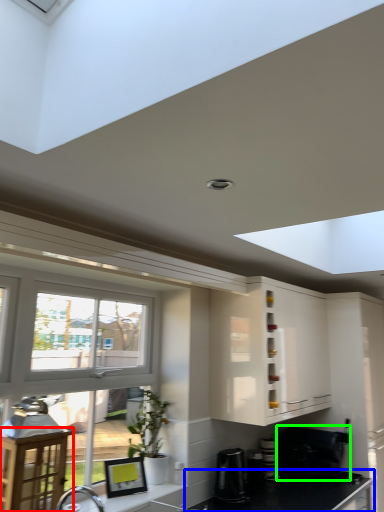
Question: Estimate the real-world distances between objects in this image. Which object is farther from table (highlighted by a red box), countertop (highlighted by a blue box) or appliance (highlighted by a green box)?

Choices:
 (A) countertop
 (B) appliance

Answer: (B)